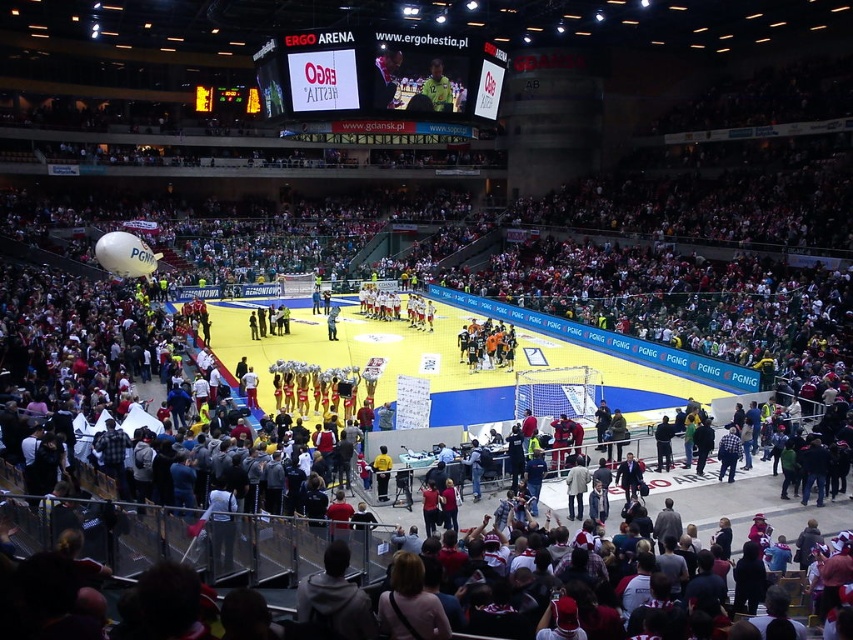
Does yellow synthetic turf at center have a larger size compared to white glossy scoreboard at upper center?

Correct, yellow synthetic turf at center is larger in size than white glossy scoreboard at upper center.

Can you confirm if yellow synthetic turf at center is wider than white glossy scoreboard at upper center?

Yes, yellow synthetic turf at center is wider than white glossy scoreboard at upper center.

Who is more forward, (x=529, y=314) or (x=329, y=106)?

Point (x=329, y=106)

Where is `yellow synthetic turf at center`? The image size is (853, 640). yellow synthetic turf at center is located at coordinates (485, 360).

Can you confirm if white glossy scoreboard at upper center is thinner than orange jersey at center?

In fact, white glossy scoreboard at upper center might be wider than orange jersey at center.

Can you confirm if white glossy scoreboard at upper center is positioned above orange jersey at center?

Correct, white glossy scoreboard at upper center is located above orange jersey at center.

This screenshot has height=640, width=853. Identify the location of white glossy scoreboard at upper center. (379, 76).

Where is `white glossy scoreboard at upper center`? white glossy scoreboard at upper center is located at coordinates (379, 76).

Can you confirm if orange jersey at center is wider than yellow-green jersey at upper center?

Yes, orange jersey at center is wider than yellow-green jersey at upper center.

Is the position of orange jersey at center more distant than that of yellow-green jersey at upper center?

Yes, orange jersey at center is further from the viewer.

The image size is (853, 640). I want to click on orange jersey at center, so click(486, 344).

You are a GUI agent. You are given a task and a screenshot of the screen. Output one action in this format:
    pyautogui.click(x=<x>, y=<y>)
    Task: Click on the orange jersey at center
    The height and width of the screenshot is (640, 853).
    Given the screenshot: What is the action you would take?
    pyautogui.click(x=486, y=344)